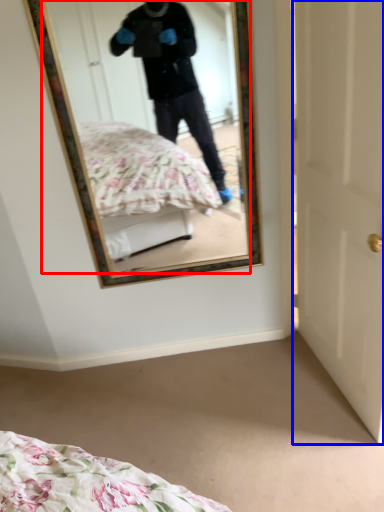
Question: Which object appears farthest to the camera in this image, mirror (highlighted by a red box) or door (highlighted by a blue box)?

Choices:
 (A) mirror
 (B) door

Answer: (A)